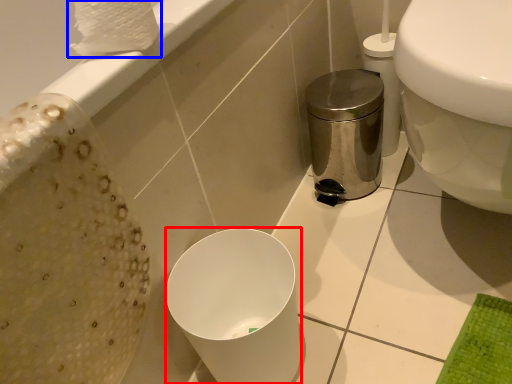
Question: Which object is further to the camera taking this photo, bidet (highlighted by a red box) or toilet paper (highlighted by a blue box)?

Choices:
 (A) bidet
 (B) toilet paper

Answer: (A)